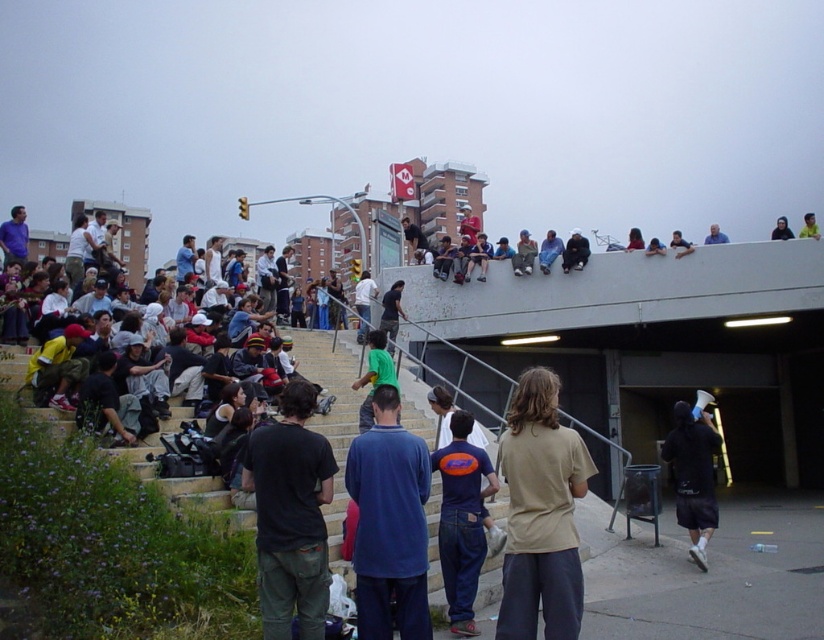
You are standing on the steps in the scene and want to move forward towards the subway entrance. There are two points marked on the steps. Which point should you step on first to move forward? The points are point (305, 504) and point (377, 365).

You should step on point (305, 504) first because it is in front of point (377, 365), so stepping on it first will allow you to move forward towards the subway entrance.